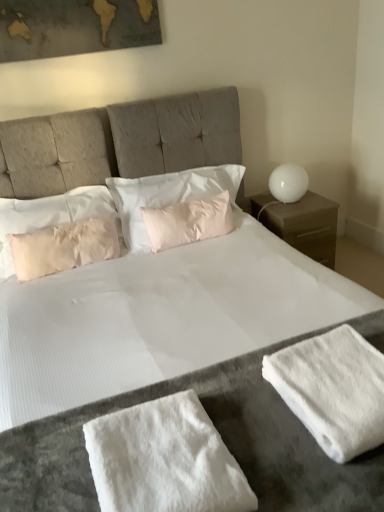
The height and width of the screenshot is (512, 384). I want to click on vacant area that is in front of white matte table lamp at right, so click(299, 210).